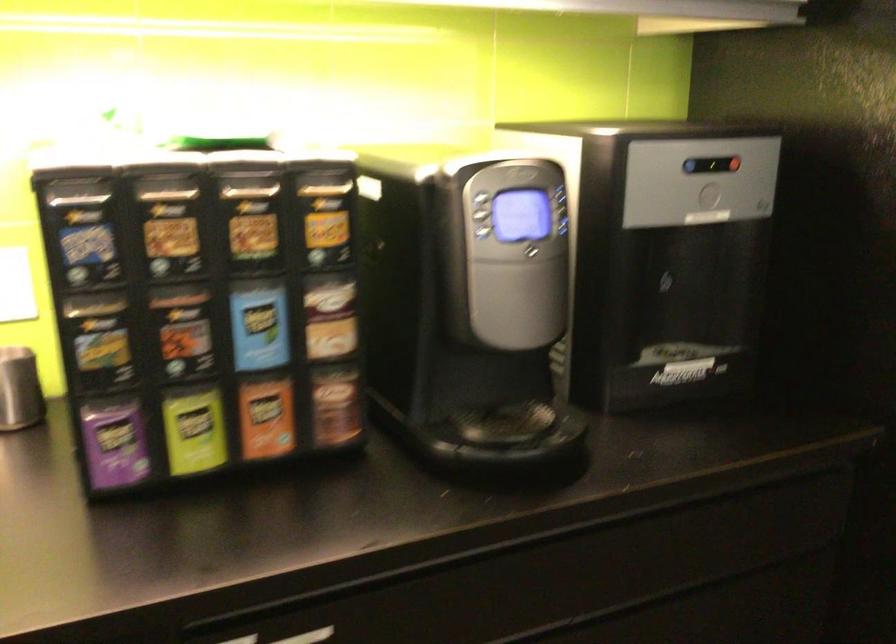
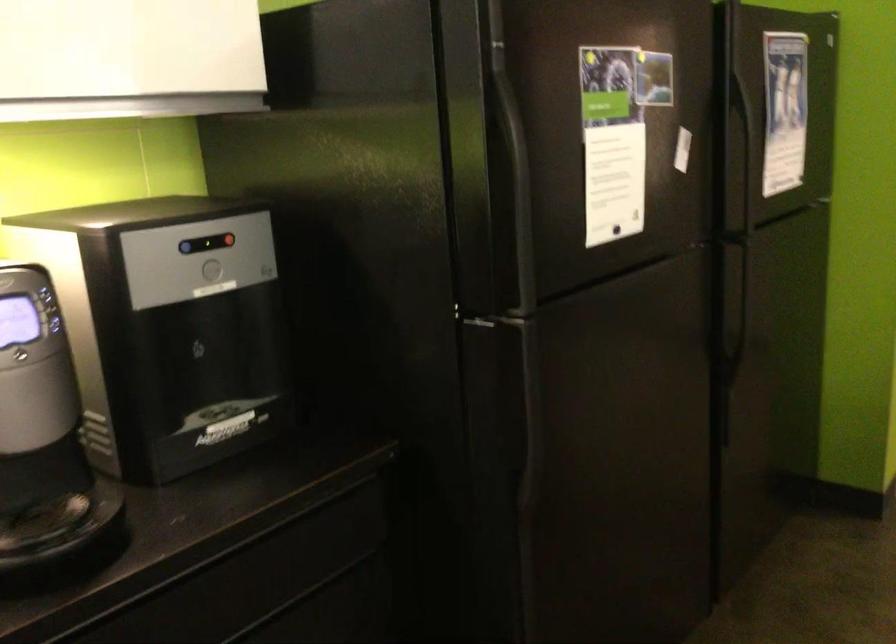
The point at (730, 161) is marked in the first image. Where is the corresponding point in the second image?

(227, 240)